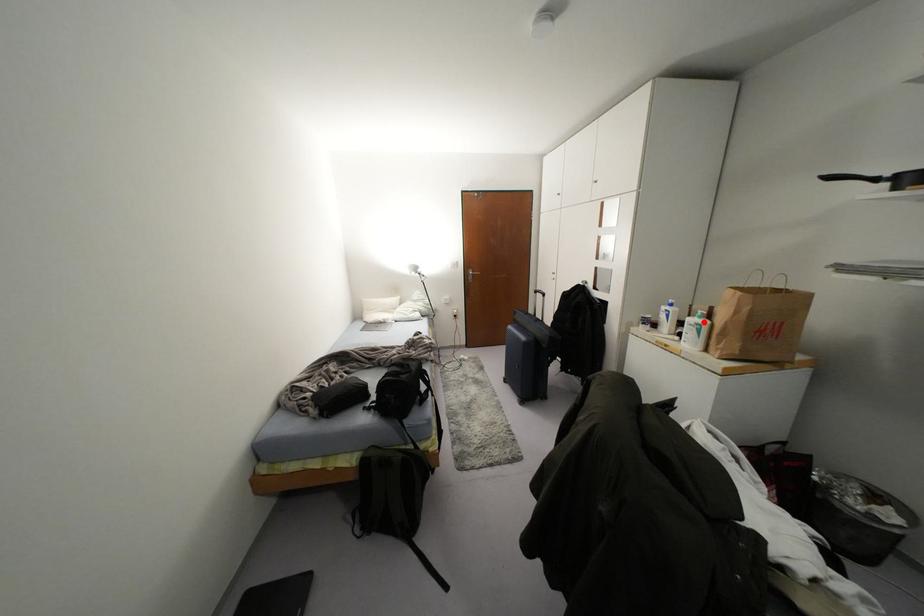
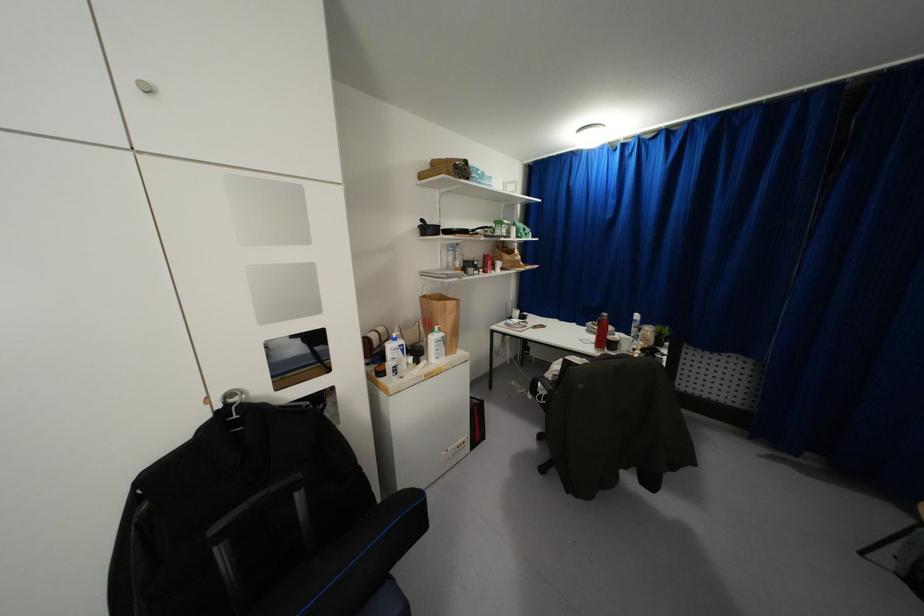
The point at the highlighted location is marked in the first image. Where is the corresponding point in the second image?

(442, 333)